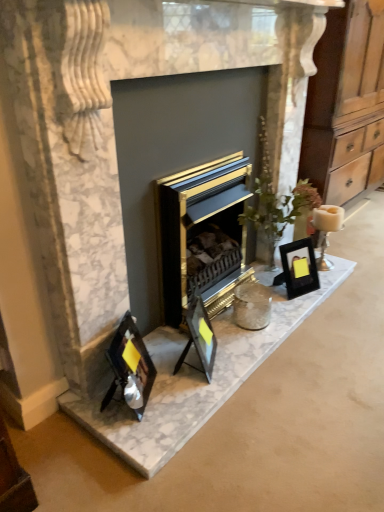
Question: Is black glass photo frame at center, the 3th picture frame positioned from the left, wider than white ceramic candle at right?

Choices:
 (A) no
 (B) yes

Answer: (A)

Question: Is black glass photo frame at center, the first picture frame viewed from the back, far away from white ceramic candle at right?

Choices:
 (A) no
 (B) yes

Answer: (A)

Question: Does black glass photo frame at center, the first picture frame viewed from the back, have a lesser width compared to white ceramic candle at right?

Choices:
 (A) no
 (B) yes

Answer: (B)

Question: Is black glass photo frame at center, which is the 3th picture frame in front-to-back order, touching white ceramic candle at right?

Choices:
 (A) no
 (B) yes

Answer: (A)

Question: Considering the relative positions of black glass photo frame at center, the 3th picture frame positioned from the left, and white ceramic candle at right in the image provided, is black glass photo frame at center, the 3th picture frame positioned from the left, to the left of white ceramic candle at right from the viewer's perspective?

Choices:
 (A) no
 (B) yes

Answer: (B)

Question: Is black glass photo frames at lower left to the left or to the right of matte black picture frame at center, placed as the second picture frame when sorted from front to back, in the image?

Choices:
 (A) right
 (B) left

Answer: (B)

Question: Considering the positions of point (269, 283) and point (193, 294), is point (269, 283) closer or farther from the camera than point (193, 294)?

Choices:
 (A) closer
 (B) farther

Answer: (B)

Question: From a real-world perspective, is black glass photo frames at lower left above or below matte black picture frame at center, the 2th picture frame from the right?

Choices:
 (A) above
 (B) below

Answer: (B)

Question: In terms of size, does black glass photo frames at lower left appear bigger or smaller than matte black picture frame at center, placed as the second picture frame when sorted from front to back?

Choices:
 (A) big
 (B) small

Answer: (B)

Question: From their relative heights in the image, would you say white ceramic candle at right is taller or shorter than black glass photo frames at lower left?

Choices:
 (A) tall
 (B) short

Answer: (A)

Question: From a real-world perspective, is white ceramic candle at right above or below black glass photo frames at lower left?

Choices:
 (A) above
 (B) below

Answer: (A)

Question: Looking at the image, does white ceramic candle at right seem bigger or smaller compared to black glass photo frames at lower left?

Choices:
 (A) big
 (B) small

Answer: (A)

Question: Is white ceramic candle at right situated inside black glass photo frames at lower left or outside?

Choices:
 (A) outside
 (B) inside

Answer: (A)

Question: Is matte black picture frame at center, the 2th picture frame from the left, spatially inside black glass photo frames at lower left, or outside of it?

Choices:
 (A) outside
 (B) inside

Answer: (A)

Question: From a real-world perspective, is matte black picture frame at center, the 2th picture frame from the left, above or below black glass photo frames at lower left?

Choices:
 (A) above
 (B) below

Answer: (A)